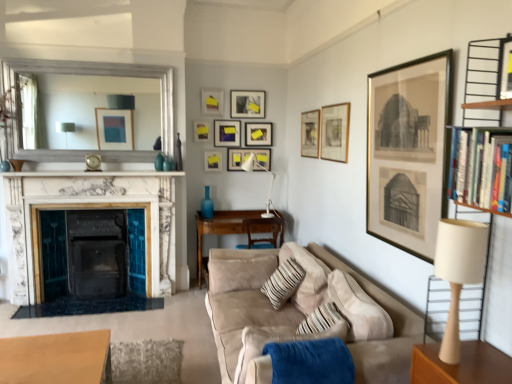
Locate an element on the screen. vacant space situated above wooden frame mirror at upper left (from a real-world perspective) is located at coordinates click(87, 57).